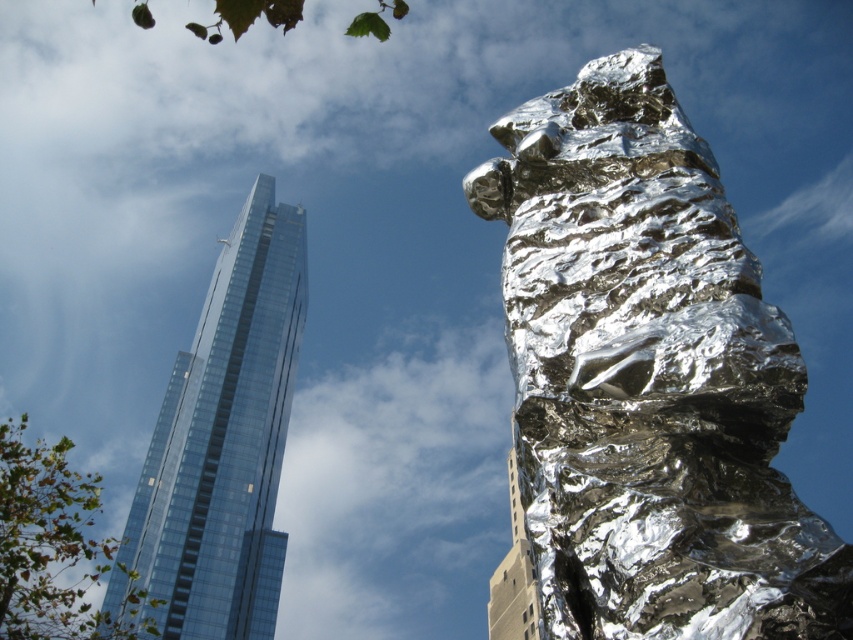
Who is higher up, shiny metallic rock at center or beige concrete building at center?

shiny metallic rock at center

The width and height of the screenshot is (853, 640). Identify the location of shiny metallic rock at center. (648, 378).

Which is more to the right, shiny metallic rock at center or transparent glass skyscraper at upper left?

shiny metallic rock at center is more to the right.

Between shiny metallic rock at center and transparent glass skyscraper at upper left, which one has more height?

transparent glass skyscraper at upper left is taller.

You are a GUI agent. You are given a task and a screenshot of the screen. Output one action in this format:
    pyautogui.click(x=<x>, y=<y>)
    Task: Click on the shiny metallic rock at center
    
    Given the screenshot: What is the action you would take?
    tap(648, 378)

The width and height of the screenshot is (853, 640). I want to click on transparent glass skyscraper at upper left, so click(225, 438).

Does transparent glass skyscraper at upper left appear on the right side of beige concrete building at center?

Incorrect, transparent glass skyscraper at upper left is not on the right side of beige concrete building at center.

Is point (230, 490) positioned behind point (509, 474)?

No, it is in front of (509, 474).

Find the location of a particular element. This screenshot has width=853, height=640. transparent glass skyscraper at upper left is located at coordinates (225, 438).